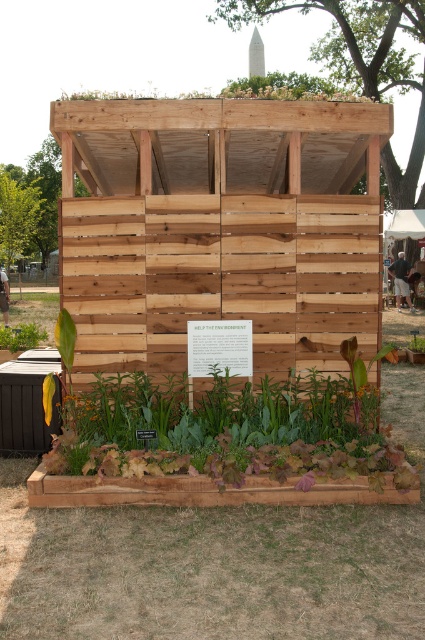
Question: Which point appears farthest from the camera in this image?

Choices:
 (A) (0, 333)
 (B) (246, 298)

Answer: (A)

Question: Can you confirm if natural wood shed at center is thinner than green leafy plant at lower left?

Choices:
 (A) no
 (B) yes

Answer: (A)

Question: Where is natural wood shed at center located in relation to green leafy plant at lower left in the image?

Choices:
 (A) below
 (B) above

Answer: (B)

Question: Does natural wood shed at center have a larger size compared to green leafy plant at lower left?

Choices:
 (A) yes
 (B) no

Answer: (A)

Question: Among these points, which one is nearest to the camera?

Choices:
 (A) (305, 333)
 (B) (28, 323)

Answer: (A)

Question: Which object is farther from the camera taking this photo?

Choices:
 (A) green leafy plant at lower left
 (B) natural wood shed at center

Answer: (A)